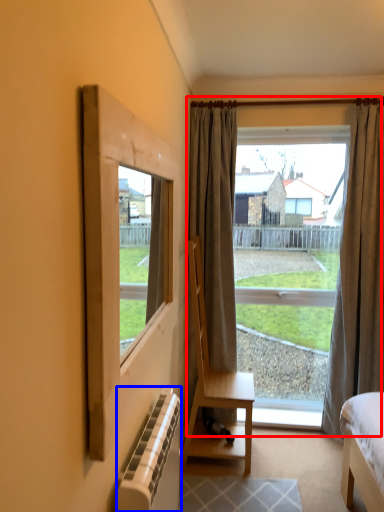
Question: Which of the following is the closest to the observer, window (highlighted by a red box) or radiator (highlighted by a blue box)?

Choices:
 (A) window
 (B) radiator

Answer: (B)